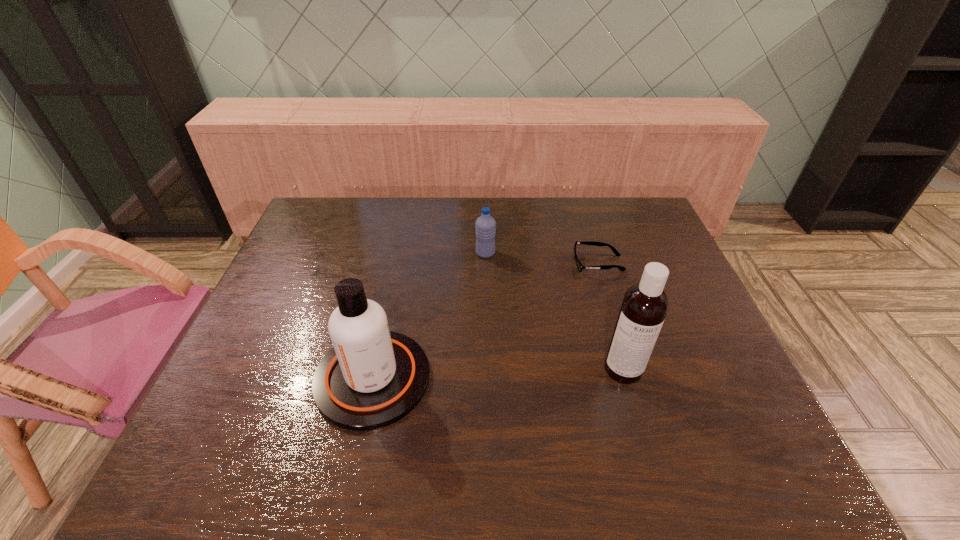
The width and height of the screenshot is (960, 540). What are the coordinates of `free space located on the front-facing side of the shortest object` in the screenshot? It's located at (492, 264).

In the image, there is a desktop. At what (x,y) coordinates should I click in order to perform the action: click on vacant space at the far edge. Please return your answer as a coordinate pair (x, y). The width and height of the screenshot is (960, 540). Looking at the image, I should click on click(467, 219).

Where is `vacant area at the near edge of the desktop`? vacant area at the near edge of the desktop is located at coordinates (507, 462).

Identify the location of vacant space at the left edge. The width and height of the screenshot is (960, 540). [271, 379].

You are a GUI agent. You are given a task and a screenshot of the screen. Output one action in this format:
    pyautogui.click(x=<x>, y=<y>)
    Task: Click on the free region at the right edge
    
    Given the screenshot: What is the action you would take?
    click(720, 357)

Image resolution: width=960 pixels, height=540 pixels. I want to click on vacant space at the far left corner, so click(x=339, y=214).

The image size is (960, 540). In order to click on free area in between the sunglasses and the second shortest object in this screenshot , I will do (541, 258).

Locate an element on the screen. blank region between the sunglasses and the dishwasher detergent is located at coordinates (611, 316).

Find the location of a particular element. This screenshot has width=960, height=540. empty location between the water bottle and the sunglasses is located at coordinates (541, 258).

This screenshot has width=960, height=540. Find the location of `free spot between the second object from left to right and the sunglasses`. free spot between the second object from left to right and the sunglasses is located at coordinates (541, 258).